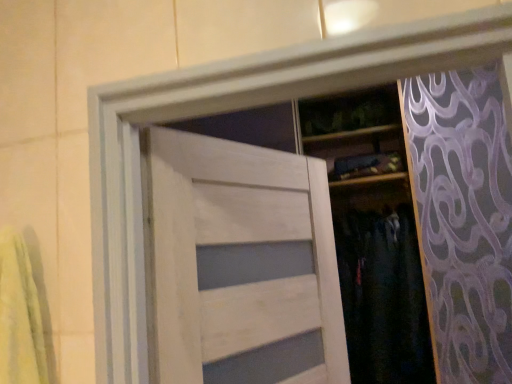
Question: Is white wood door at center taller or shorter than dark fabric pants at center?

Choices:
 (A) short
 (B) tall

Answer: (A)

Question: From a real-world perspective, is white wood door at center above or below dark fabric pants at center?

Choices:
 (A) above
 (B) below

Answer: (A)

Question: From the image's perspective, relative to dark fabric pants at center, is white wood door at center above or below?

Choices:
 (A) below
 (B) above

Answer: (B)

Question: In terms of width, does dark fabric pants at center look wider or thinner when compared to white wood door at center?

Choices:
 (A) thin
 (B) wide

Answer: (B)

Question: Considering the positions of point (395, 307) and point (233, 311), is point (395, 307) closer or farther from the camera than point (233, 311)?

Choices:
 (A) closer
 (B) farther

Answer: (B)

Question: In terms of height, does dark fabric pants at center look taller or shorter compared to white wood door at center?

Choices:
 (A) short
 (B) tall

Answer: (B)

Question: Is dark fabric pants at center inside the boundaries of white wood door at center, or outside?

Choices:
 (A) outside
 (B) inside

Answer: (A)